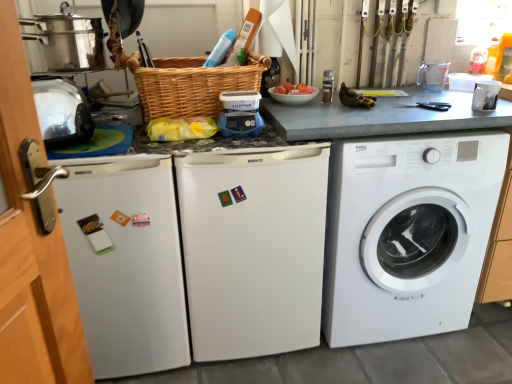
Locate an element on the screen. Image resolution: width=512 pixels, height=384 pixels. vacant space to the right of shiny metallic toaster at left, which appears as the 1th appliance when viewed from the left is located at coordinates (120, 143).